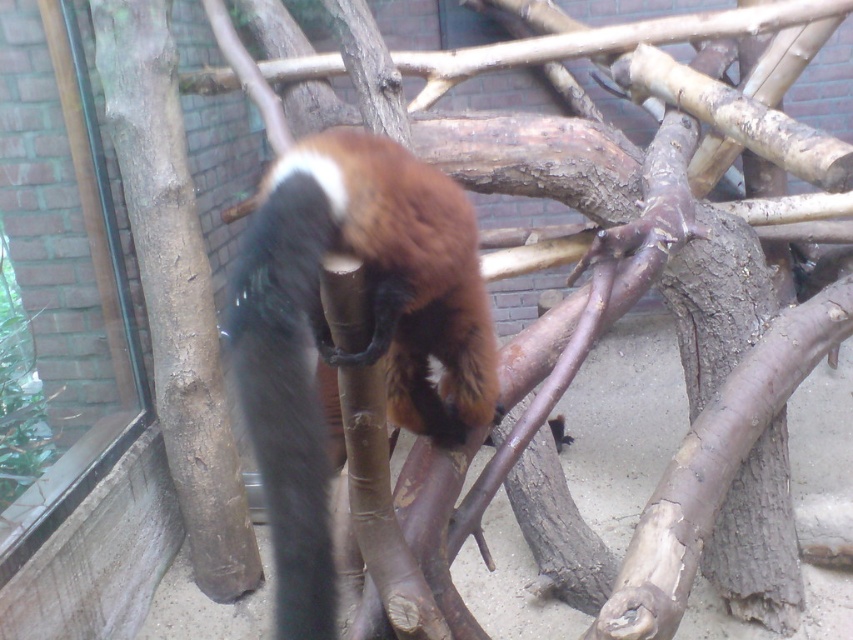
Question: Which of the following is the closest to the observer?

Choices:
 (A) brown rough tree trunk at left
 (B) brown furry animal at center

Answer: (B)

Question: From the image, what is the correct spatial relationship of brown furry animal at center in relation to brown rough tree trunk at left?

Choices:
 (A) right
 (B) left

Answer: (A)

Question: Can you confirm if brown furry animal at center is thinner than brown rough tree trunk at left?

Choices:
 (A) no
 (B) yes

Answer: (B)

Question: Can you confirm if brown furry animal at center is positioned below brown rough tree trunk at left?

Choices:
 (A) yes
 (B) no

Answer: (A)

Question: Among these points, which one is farthest from the camera?

Choices:
 (A) (189, 376)
 (B) (296, 317)

Answer: (A)

Question: Which of the following is the farthest from the observer?

Choices:
 (A) brown furry animal at center
 (B) brown rough tree trunk at left

Answer: (B)